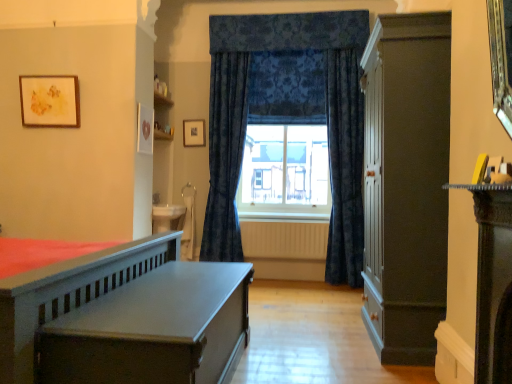
Question: Is matte gray wooden bed at left surrounding white textured radiator at center?

Choices:
 (A) yes
 (B) no

Answer: (B)

Question: From the image's perspective, is matte gray wooden bed at left below white textured radiator at center?

Choices:
 (A) yes
 (B) no

Answer: (A)

Question: Is matte gray wooden bed at left bigger than white textured radiator at center?

Choices:
 (A) yes
 (B) no

Answer: (A)

Question: Does matte gray wooden bed at left have a lesser width compared to white textured radiator at center?

Choices:
 (A) no
 (B) yes

Answer: (A)

Question: From the image's perspective, is matte gray wooden bed at left on white textured radiator at center?

Choices:
 (A) no
 (B) yes

Answer: (A)

Question: Considering the positions of point (376, 281) and point (52, 87), is point (376, 281) closer or farther from the camera than point (52, 87)?

Choices:
 (A) closer
 (B) farther

Answer: (A)

Question: In terms of width, does matte dark brown cabinet at right look wider or thinner when compared to wooden picture frame at upper left, the 1th picture frame in the left-to-right sequence?

Choices:
 (A) thin
 (B) wide

Answer: (B)

Question: Is matte dark brown cabinet at right to the left or to the right of wooden picture frame at upper left, which is the 2th picture frame from back to front, in the image?

Choices:
 (A) left
 (B) right

Answer: (B)

Question: Considering their positions, is matte dark brown cabinet at right located in front of or behind wooden picture frame at upper left, which is the 2th picture frame from back to front?

Choices:
 (A) front
 (B) behind

Answer: (A)

Question: In the image, is matte gray wooden bed at left positioned in front of or behind white textured radiator at center?

Choices:
 (A) front
 (B) behind

Answer: (A)

Question: In terms of height, does matte gray wooden bed at left look taller or shorter compared to white textured radiator at center?

Choices:
 (A) short
 (B) tall

Answer: (B)

Question: Is matte gray wooden bed at left inside the boundaries of white textured radiator at center, or outside?

Choices:
 (A) outside
 (B) inside

Answer: (A)

Question: In the image, is matte gray wooden bed at left on the left side or the right side of white textured radiator at center?

Choices:
 (A) left
 (B) right

Answer: (A)

Question: In terms of height, does dark blue velvet curtains at center, the second curtain viewed from the right, look taller or shorter compared to wooden picture frame at upper left, which is counted as the first picture frame, starting from the front?

Choices:
 (A) short
 (B) tall

Answer: (B)

Question: Is point (222, 74) positioned closer to the camera than point (76, 91)?

Choices:
 (A) closer
 (B) farther

Answer: (B)